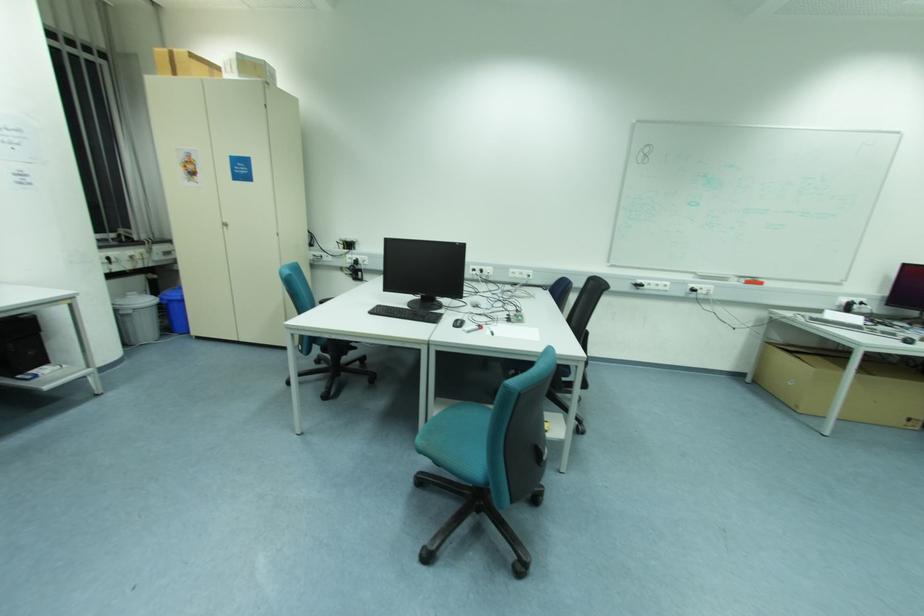
Locate an element on the screen. The image size is (924, 616). cabinet door handle is located at coordinates (225, 225).